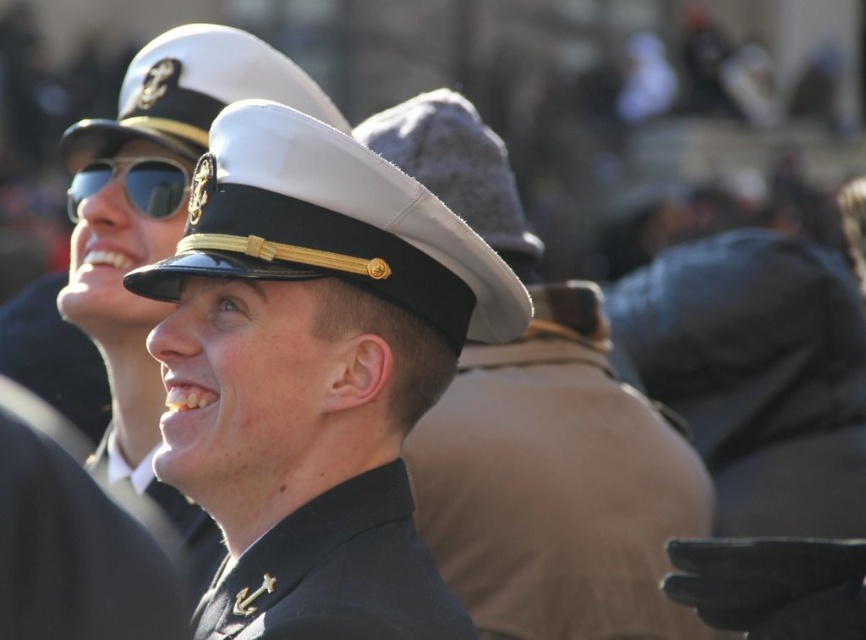
Question: Which object is the closest to the matte black goggles at upper left?

Choices:
 (A) matte black uniform at center
 (B) glossy black hat at center
 (C) glossy white hat at center

Answer: (C)

Question: Which object is farther from the camera taking this photo?

Choices:
 (A) matte black uniform at center
 (B) black matte uniform at center

Answer: (A)

Question: Which object is positioned farthest from the fuzzy gray hat at center?

Choices:
 (A) black matte uniform at center
 (B) matte black uniform at center
 (C) glossy white hat at center
 (D) matte black goggles at upper left

Answer: (A)

Question: Does glossy black hat at center have a larger size compared to glossy white hat at center?

Choices:
 (A) yes
 (B) no

Answer: (A)

Question: Can you confirm if black matte uniform at center is positioned above fuzzy gray hat at center?

Choices:
 (A) yes
 (B) no

Answer: (B)

Question: Is glossy white hat at center positioned in front of fuzzy gray hat at center?

Choices:
 (A) no
 (B) yes

Answer: (B)